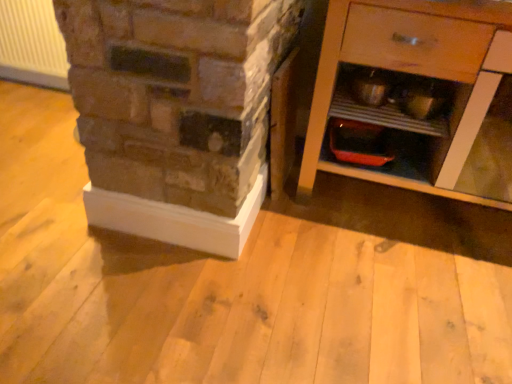
This screenshot has width=512, height=384. I want to click on free space in front of wooden cabinet at right, so click(385, 291).